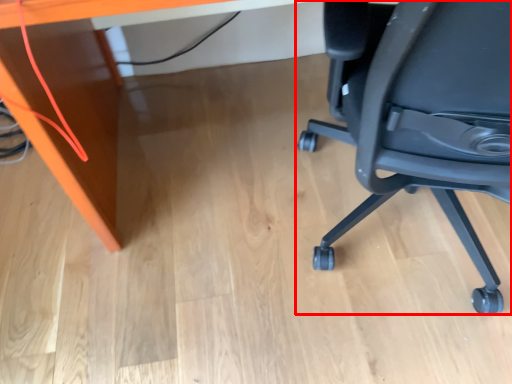
Question: From the image's perspective, what is the correct spatial relationship of chair (annotated by the red box) in relation to desk?

Choices:
 (A) above
 (B) below

Answer: (B)